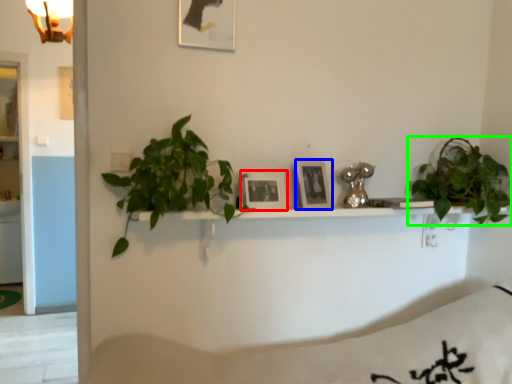
Question: Based on their relative distances, which object is nearer to picture frame (highlighted by a red box)? Choose from picture frame (highlighted by a blue box) and houseplant (highlighted by a green box).

Choices:
 (A) picture frame
 (B) houseplant

Answer: (A)